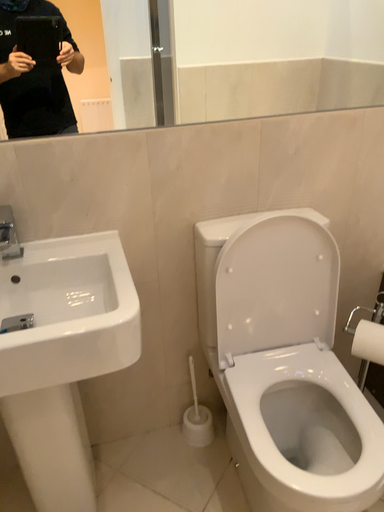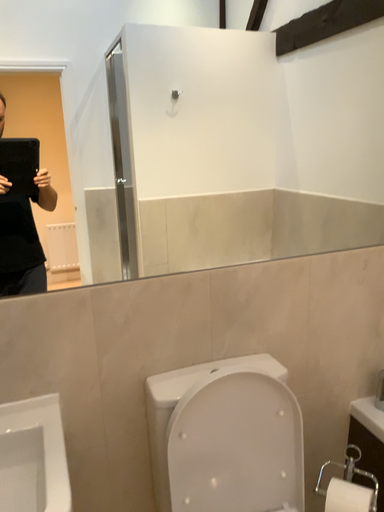
Question: How did the camera likely rotate when shooting the video?

Choices:
 (A) rotated downward
 (B) rotated upward

Answer: (B)